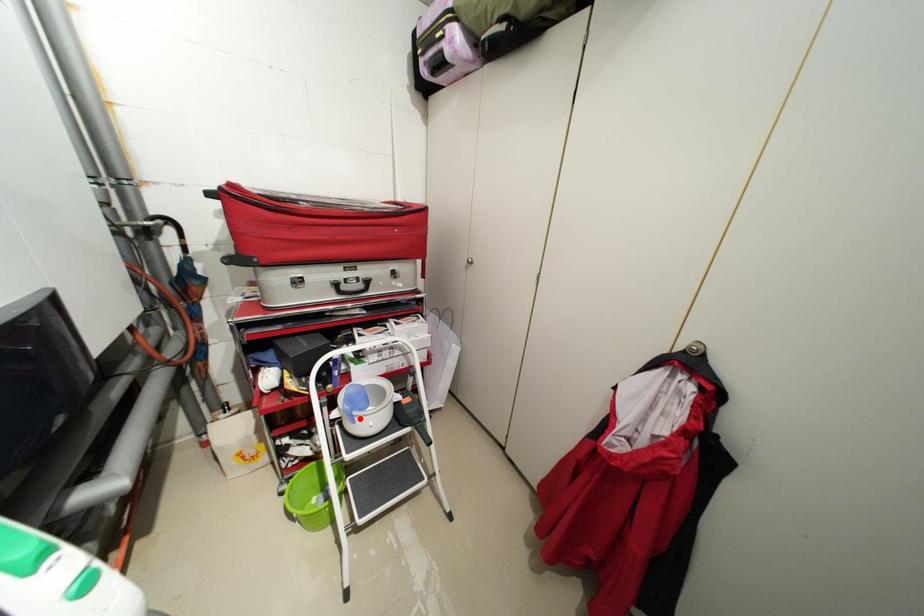
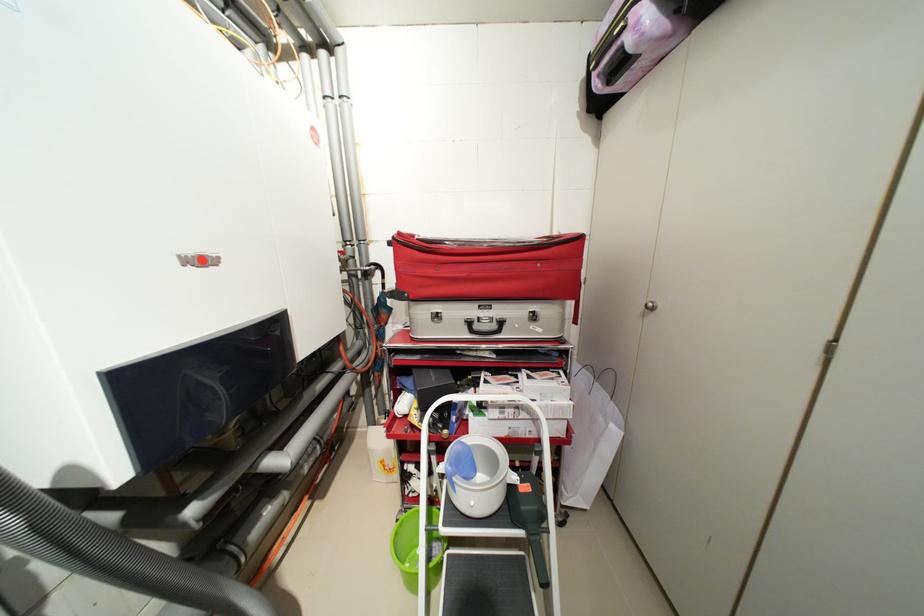
Question: I am providing you with two images of the same scene from different viewpoints. A red point is marked on the first image. Is the red point's position out of view in image 2?

Choices:
 (A) Yes
 (B) No

Answer: (B)